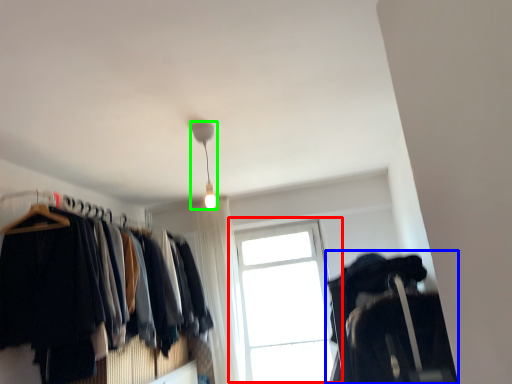
Question: Which object is positioned farthest from window (highlighted by a red box)? Select from closet (highlighted by a blue box) and lamp (highlighted by a green box).

Choices:
 (A) closet
 (B) lamp

Answer: (B)